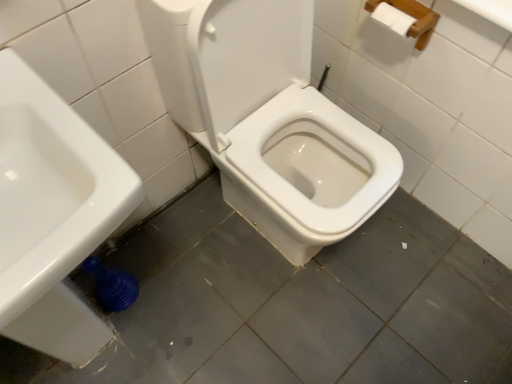
Identify the location of vacant area that lies between white glossy toilet at center and white glossy sink at lower left. (211, 269).